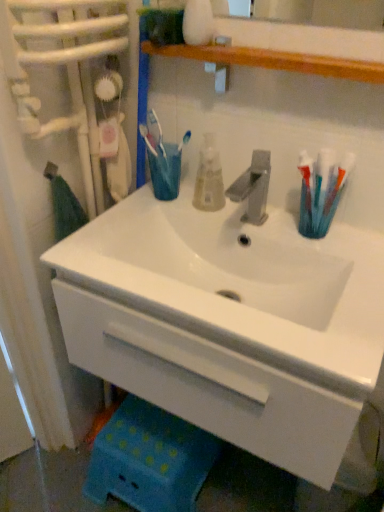
This screenshot has width=384, height=512. Find the location of `vacant area that is in front of translucent plastic cup at center`. vacant area that is in front of translucent plastic cup at center is located at coordinates (139, 218).